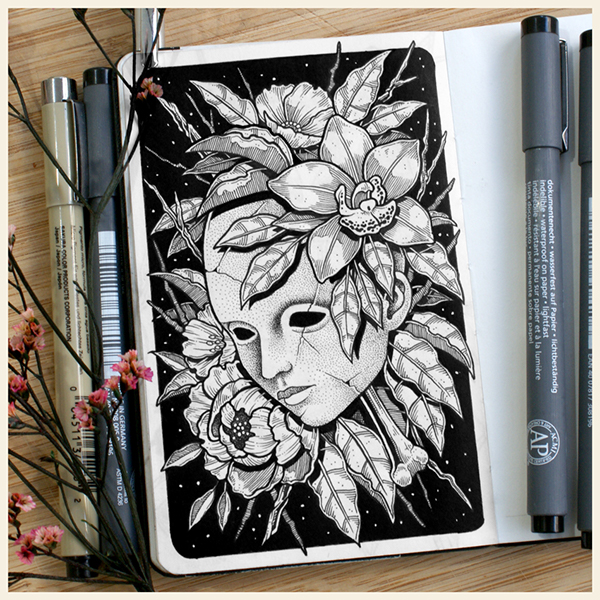
Identify the location of table. This screenshot has width=600, height=600. (495, 566).